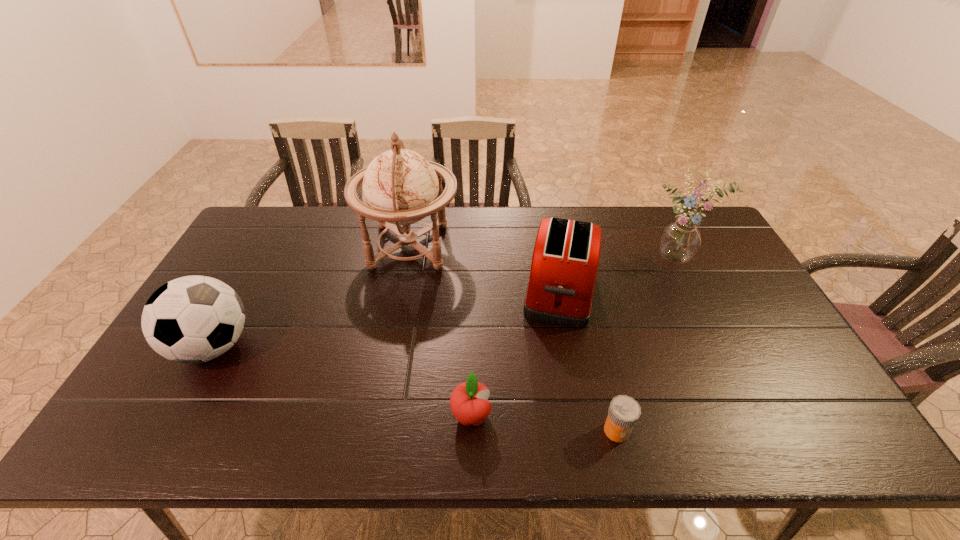
Find the location of `blank region between the toaster and the apple`. blank region between the toaster and the apple is located at coordinates (516, 354).

Find the location of a particular element. This screenshot has width=960, height=540. vacant space that is in between the toaster and the medicine is located at coordinates (588, 361).

At what (x,y) coordinates should I click in order to perform the action: click on free space that is in between the tallest object and the medicine. Please return your answer as a coordinate pair (x, y). This screenshot has height=540, width=960. Looking at the image, I should click on (513, 339).

Where is `empty location between the apple and the soccer ball`? empty location between the apple and the soccer ball is located at coordinates (342, 381).

This screenshot has width=960, height=540. I want to click on free space that is in between the medicine and the toaster, so click(x=588, y=361).

Where is `vacant space in between the bouquet and the shortest object`? The image size is (960, 540). vacant space in between the bouquet and the shortest object is located at coordinates click(x=648, y=345).

Identify which object is the second closest to the tallest object. Please provide its 2D coordinates. Your answer should be formatted as a tuple, i.e. [(x, y)], where the tuple contains the x and y coordinates of a point satisfying the conditions above.

[(193, 319)]

Identify which object is located as the nearest to the second object from left to right. Please provide its 2D coordinates. Your answer should be formatted as a tuple, i.e. [(x, y)], where the tuple contains the x and y coordinates of a point satisfying the conditions above.

[(565, 260)]

Identify the location of vacant space that satisfies the following two spatial constraints: 1. at the front of the toaster showing Africa; 2. on the right side of the fifth object from right to left. (401, 292).

The width and height of the screenshot is (960, 540). What are the coordinates of `vacant area in the image that satisfies the following two spatial constraints: 1. on the main logo of the fifth tallest object; 2. on the left side of the soccer ball` in the screenshot? It's located at (175, 416).